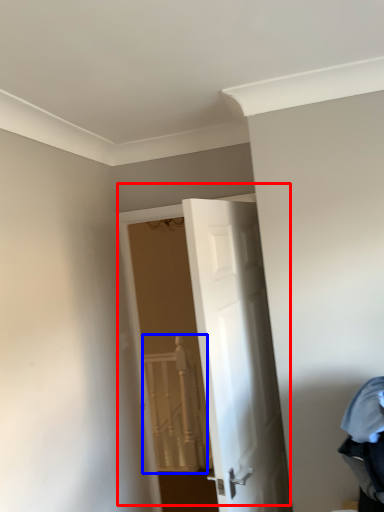
Question: Which point is further to the camera, door (highlighted by a red box) or rail (highlighted by a blue box)?

Choices:
 (A) door
 (B) rail

Answer: (B)